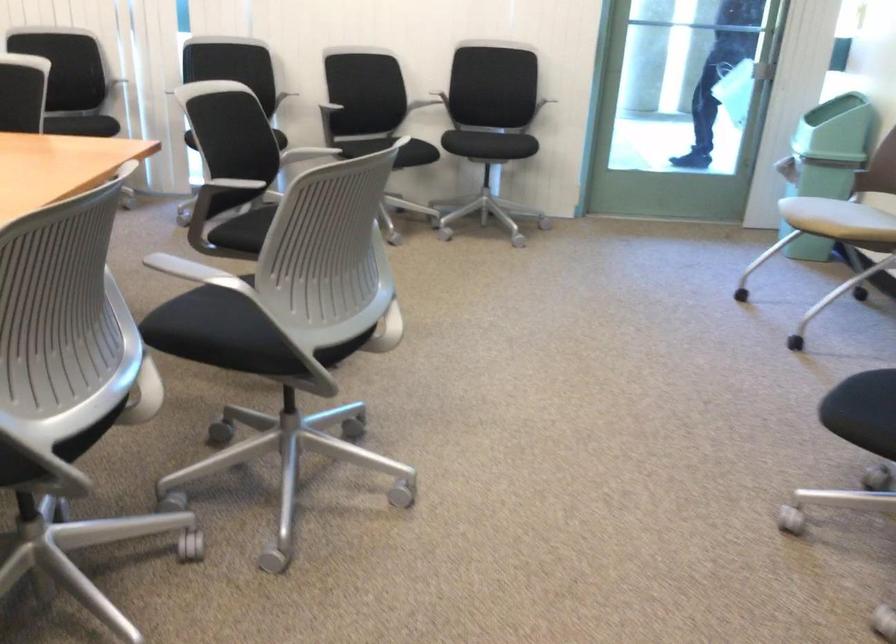
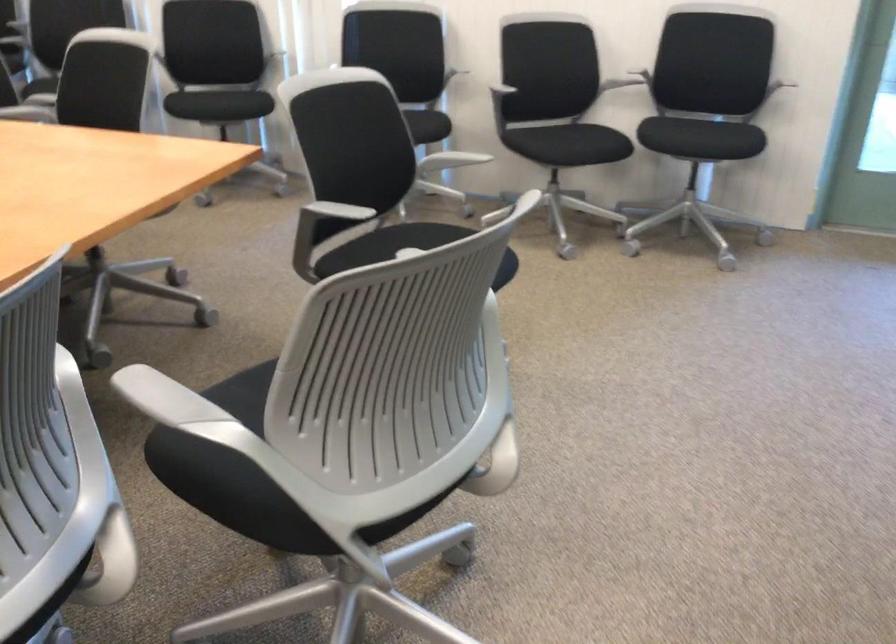
Where in the second image is the point corresponding to point 549,98 from the first image?

(778, 86)